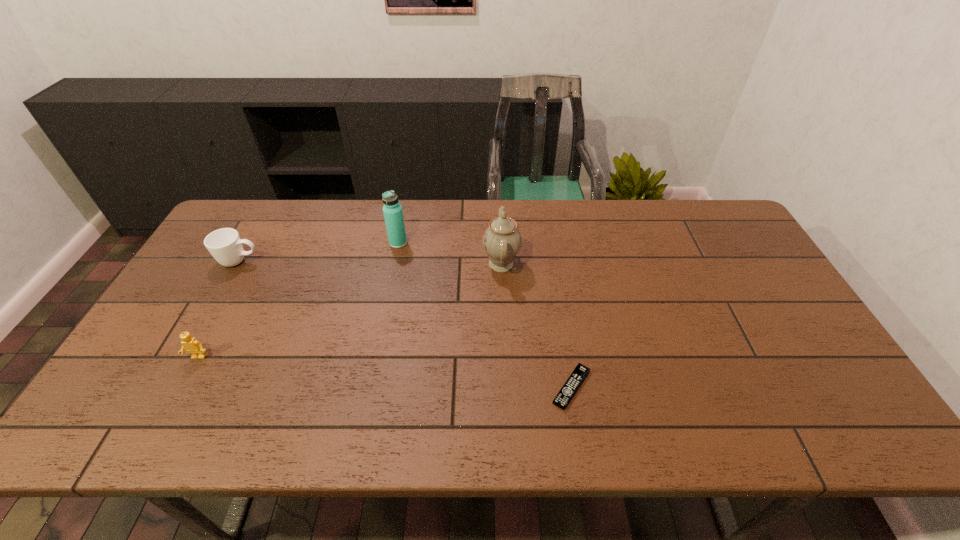
Locate an element on the screen. free space at the far left corner is located at coordinates (255, 244).

Identify the location of blank space at the far right corner of the desktop. The width and height of the screenshot is (960, 540). (713, 215).

Image resolution: width=960 pixels, height=540 pixels. Find the location of `unoccupied area between the fourth object from left to right and the cup`. unoccupied area between the fourth object from left to right and the cup is located at coordinates (371, 262).

Where is `empty location between the third object from left to right and the nearest object`? empty location between the third object from left to right and the nearest object is located at coordinates (485, 315).

Find the location of `free space between the cup and the second nearest object`. free space between the cup and the second nearest object is located at coordinates (219, 309).

The height and width of the screenshot is (540, 960). In order to click on free space between the remote control and the fourth farthest object in this screenshot , I will do `click(385, 372)`.

You are a GUI agent. You are given a task and a screenshot of the screen. Output one action in this format:
    pyautogui.click(x=<x>, y=<y>)
    Task: Click on the unoccupied position between the third object from right to left and the fourth farthest object
    This screenshot has height=540, width=960.
    Given the screenshot: What is the action you would take?
    pyautogui.click(x=299, y=300)

Where is `free space between the remote control and the cup`? free space between the remote control and the cup is located at coordinates (405, 324).

Where is `free space that is in between the third object from right to left and the cup`? free space that is in between the third object from right to left and the cup is located at coordinates (319, 252).

Where is `free space between the cup and the Lego`? free space between the cup and the Lego is located at coordinates (219, 309).